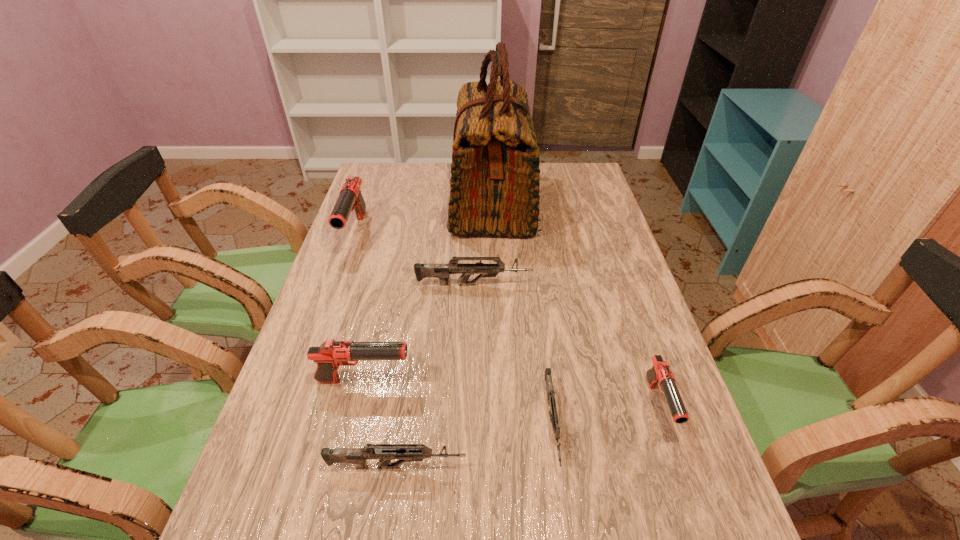
Locate which black gun is the closest to the second tallest gun. Please provide its 2D coordinates. Your answer should be formatted as a tuple, i.e. [(x, y)], where the tuple contains the x and y coordinates of a point satisfying the conditions above.

[(350, 198)]

Select which black gun is the closest to the sixth tallest object. Please provide its 2D coordinates. Your answer should be formatted as a tuple, i.e. [(x, y)], where the tuple contains the x and y coordinates of a point satisfying the conditions above.

[(330, 355)]

Point out which grey gun is positioned as the third nearest to the sixth shortest object. Please provide its 2D coordinates. Your answer should be formatted as a tuple, i.e. [(x, y)], where the tuple contains the x and y coordinates of a point satisfying the conditions above.

[(553, 415)]

Image resolution: width=960 pixels, height=540 pixels. I want to click on grey gun identified as the third closest to the tallest gun, so click(553, 415).